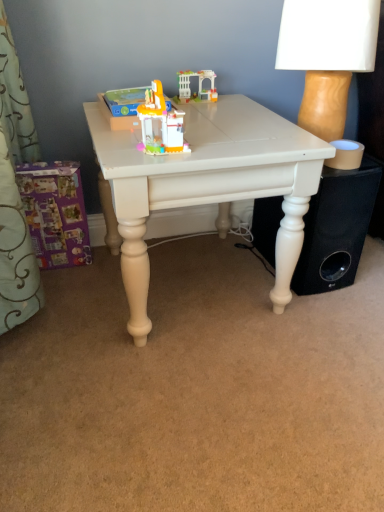
This screenshot has width=384, height=512. What are the coordinates of `free space to the left of black matte speaker at lower right` in the screenshot? It's located at (237, 271).